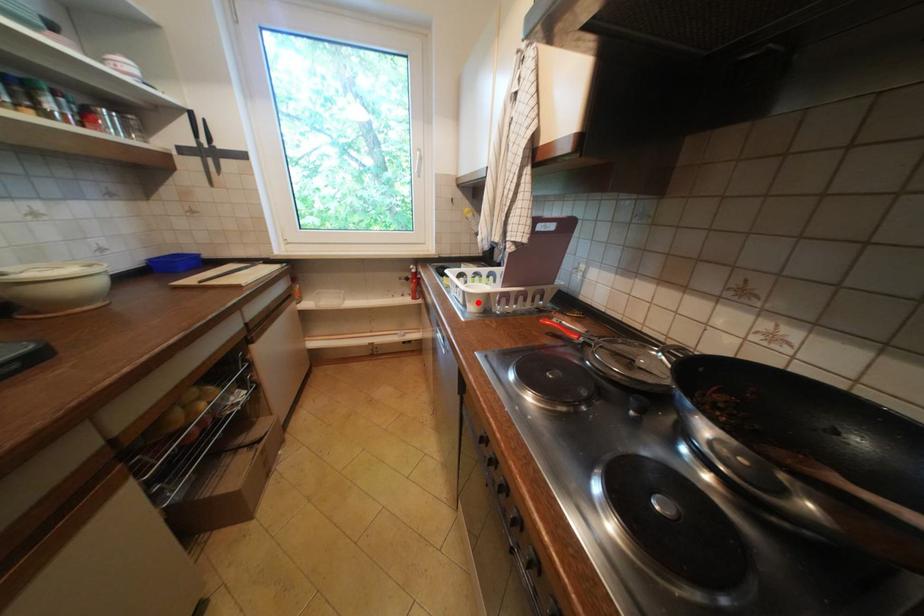
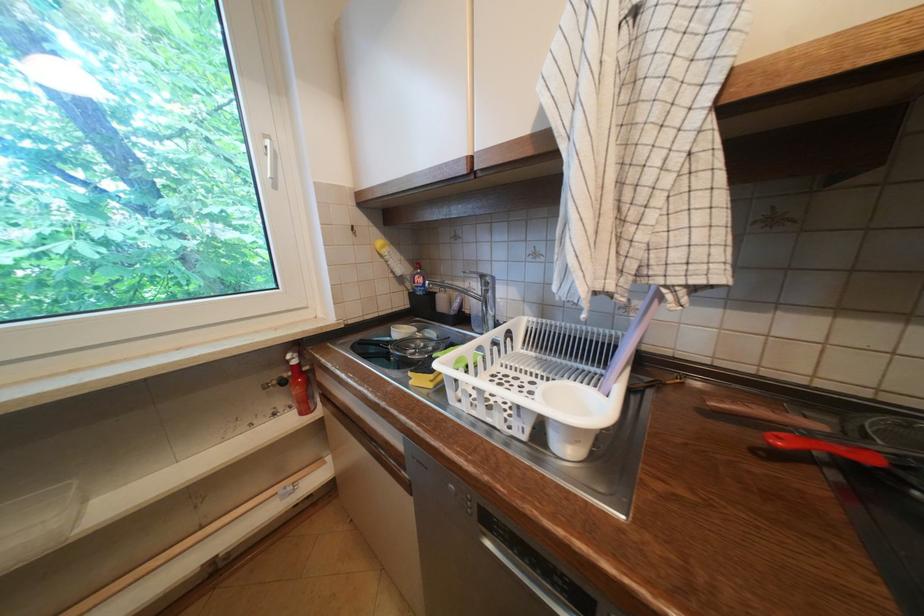
Find the pixel in the second image that matches the highlighted location in the first image.

(586, 443)